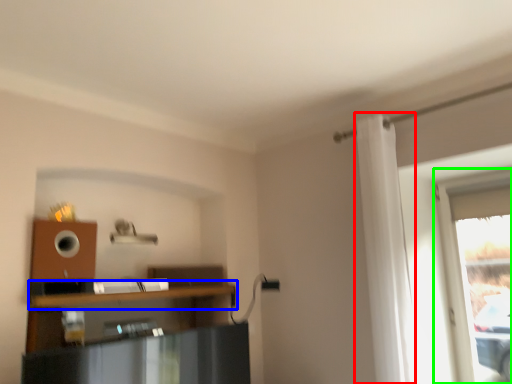
Question: Based on their relative distances, which object is farther from curtain (highlighted by a red box)? Choose from shelf (highlighted by a blue box) and window (highlighted by a green box).

Choices:
 (A) shelf
 (B) window

Answer: (A)